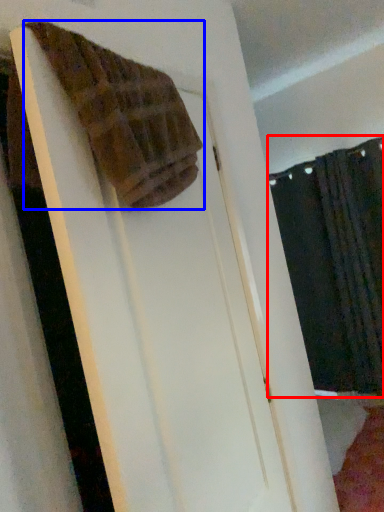
Question: Which of the following is the closest to the observer, curtain (highlighted by a red box) or towel (highlighted by a blue box)?

Choices:
 (A) curtain
 (B) towel

Answer: (B)